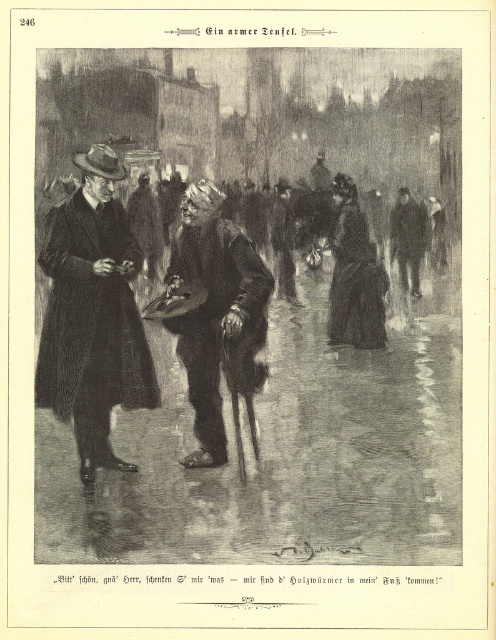
In the scene described, there are two coats visible. The smooth black coat at center and the coarse wool coat at left. Which coat is positioned to the right of the other?

The smooth black coat at center is positioned to the right of the coarse wool coat at left.

You are a tailor in the 19th century who needs to measure the distance between the coarse wool coat at left and the dark gray wool hat at center for a client. Given that the client requires the items to be at least 24 inches apart, can you confirm if the current placement meets their requirement?

The coarse wool coat at left and dark gray wool hat at center are 24.26 inches apart from each other, which exceeds the client requirement of 24 inches, so the current placement meets the requirement.